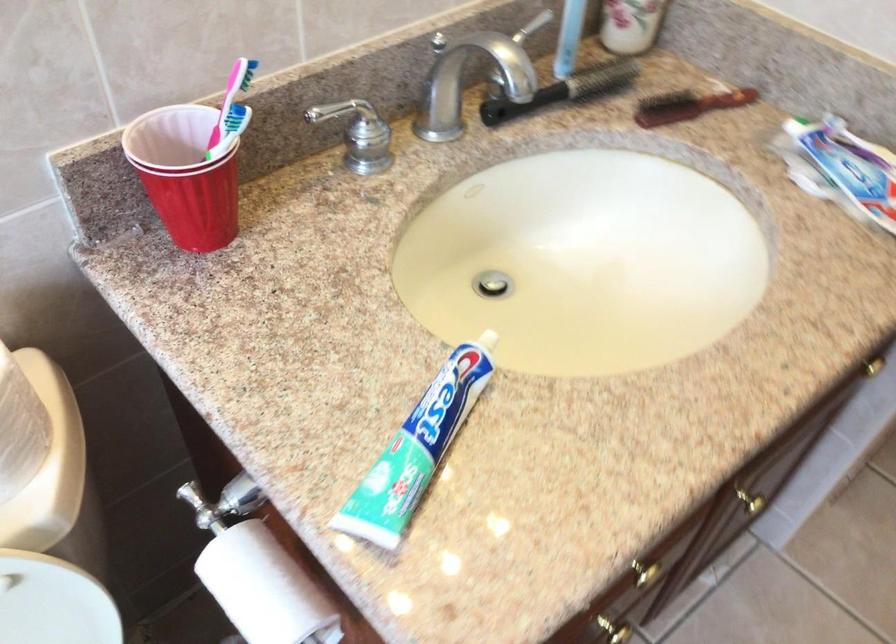
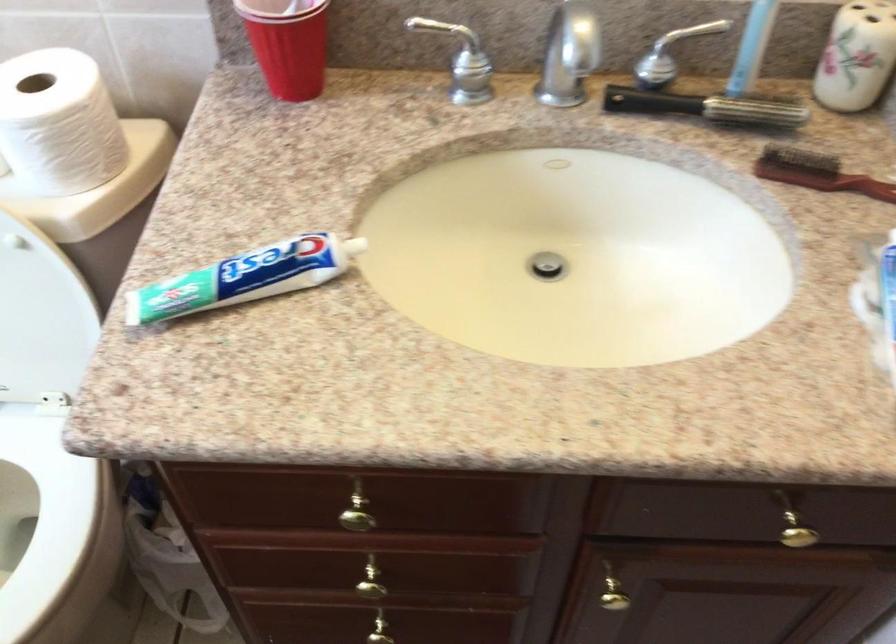
The point at (684, 105) is marked in the first image. Where is the corresponding point in the second image?

(816, 173)